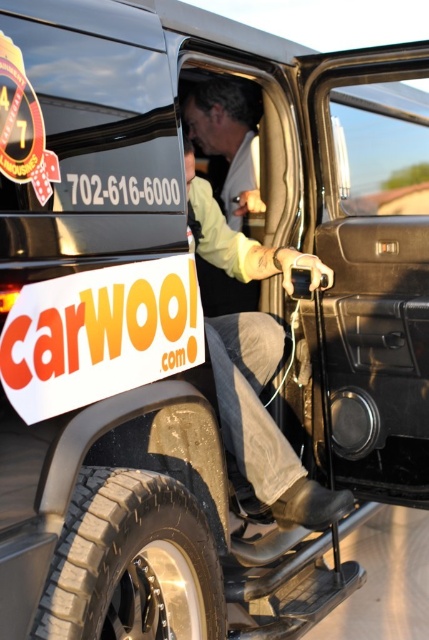
You are a photographer trying to capture the black rubber tire at lower left and the denim pants at lower center in the same frame. Which object should you zoom out to include both?

The black rubber tire at lower left is smaller than denim pants at lower center, so you should zoom out to include both the black rubber tire at lower left and the denim pants at lower center.

You are a photographer trying to capture the black rubber tire at lower left and denim pants at lower center in the same frame. Since the tire is thinner than the denim pants, which object should you focus on first to ensure both are in focus?

The black rubber tire at lower left is thinner than the denim pants at lower center, so you should focus on the denim pants at lower center first because it has a larger surface area and will be easier to keep in focus while adjusting for the thinner tire.

You are standing in front of the Jeep and need to check if the black rubber tire at lower left is underneath the denim pants at lower center. Based on the scene description, is this true?

Yes, the black rubber tire at lower left is positioned under denim pants at lower center according to the description.